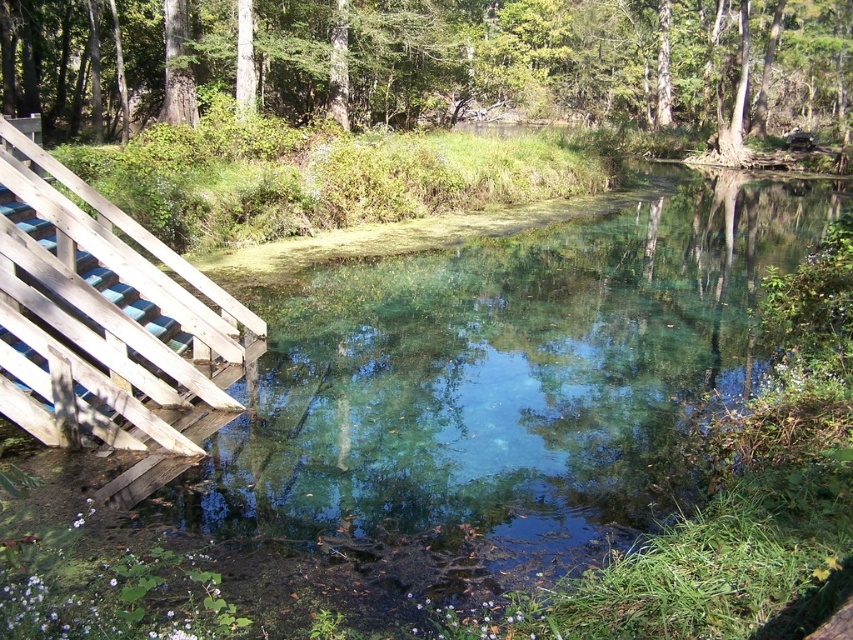
Question: Is green leafy tree at upper center to the right of wooden planks at left from the viewer's perspective?

Choices:
 (A) no
 (B) yes

Answer: (B)

Question: Which of the following is the closest to the observer?

Choices:
 (A) (647, 113)
 (B) (167, 323)

Answer: (B)

Question: Is green leafy tree at upper center to the right of wooden planks at left from the viewer's perspective?

Choices:
 (A) no
 (B) yes

Answer: (B)

Question: Which point is farther to the camera?

Choices:
 (A) wooden planks at left
 (B) green leafy tree at upper center

Answer: (B)

Question: Does green leafy tree at upper center have a lesser width compared to wooden planks at left?

Choices:
 (A) yes
 (B) no

Answer: (B)